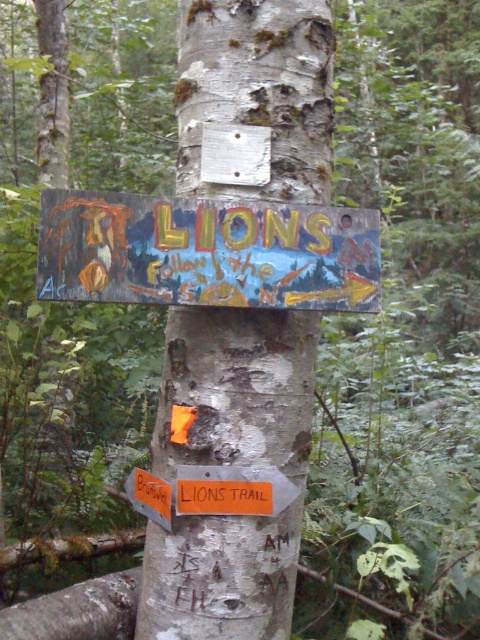
Can you confirm if wooden painted signboard at center is shorter than white rough bark at center?

Indeed, wooden painted signboard at center has a lesser height compared to white rough bark at center.

Does point (347, 252) lie in front of point (253, 376)?

Yes, it is.

Identify the location of wooden painted signboard at center. The height and width of the screenshot is (640, 480). (205, 252).